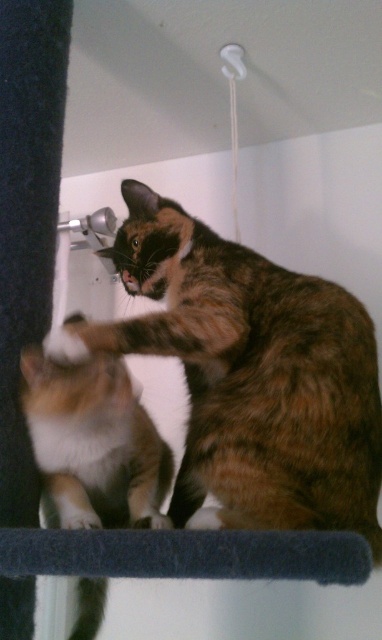
Which is more to the left, calico fur cat at center or calico fur cat at lower left?

calico fur cat at lower left

Which is in front, point (218, 508) or point (50, 468)?

Point (218, 508) is more forward.

This screenshot has height=640, width=382. Describe the element at coordinates (249, 376) in the screenshot. I see `calico fur cat at center` at that location.

At what (x,y) coordinates should I click in order to perform the action: click on calico fur cat at center. Please return your answer as a coordinate pair (x, y). The image size is (382, 640). Looking at the image, I should click on (249, 376).